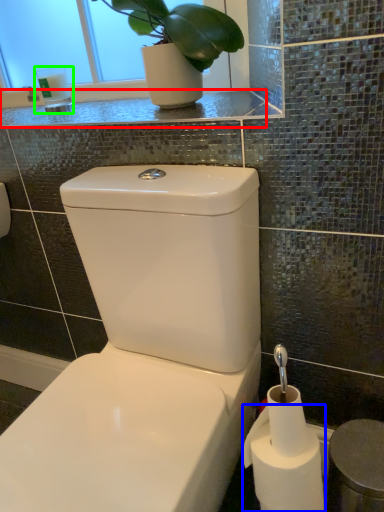
Question: Considering the real-world distances, which object is farthest from counter top (highlighted by a red box)? toilet paper (highlighted by a blue box) or toiletry (highlighted by a green box)?

Choices:
 (A) toilet paper
 (B) toiletry

Answer: (A)